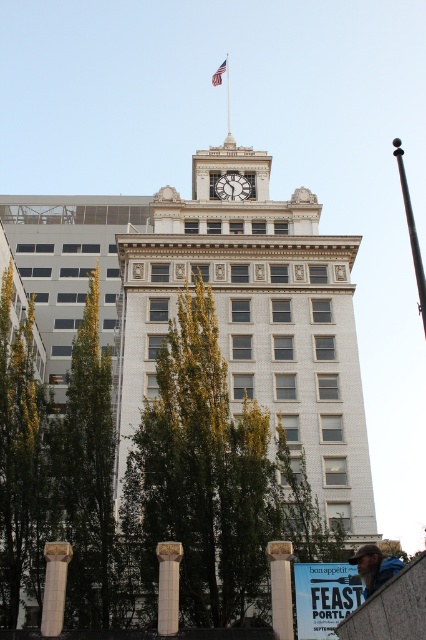
You are standing in front of the building and want to take a photo that includes both the white marble column at lower center and the metallic flag pole at upper center. Which object will appear closer to the camera in the photo?

The white marble column at lower center appears closer to the camera in the photo because it is in front of the metallic flag pole at upper center.

You are standing in front of the building and want to take a photo that includes both the white marble column at lower center and the metallic flag pole at upper center. Considering their distance apart, is it possible to capture both in a single frame without moving your camera position?

The white marble column at lower center is 161.00 meters from the metallic flag pole at upper center. Since the distance between them is quite large, it might be challenging to capture both in a single frame without moving the camera. However, using a wide angle lens could potentially include both in the shot depending on the camera sensor and lens capabilities.

You are a photographer standing in front of the building. You want to capture a photo where both the white glossy clock at upper center and the metallic flag pole at upper center are clearly visible. Which object should you focus on first to ensure both are in frame?

You should focus on the metallic flag pole at upper center first because it is larger than the white glossy clock at upper center, allowing you to frame it properly before adjusting for the smaller clock.